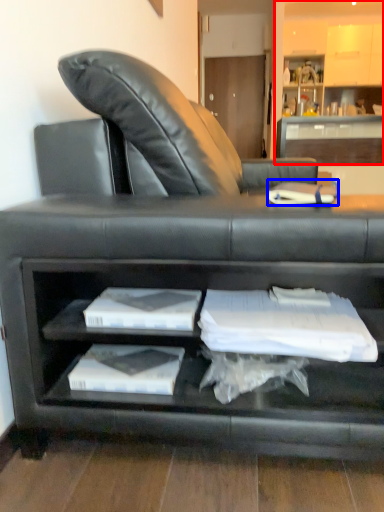
Question: Which object appears farthest to the camera in this image, entertainment center (highlighted by a red box) or book (highlighted by a blue box)?

Choices:
 (A) entertainment center
 (B) book

Answer: (A)